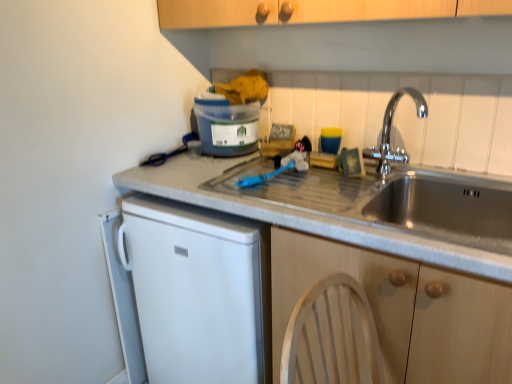
The image size is (512, 384). Find the location of `vacant area that is in front of matte plastic container at upper center`. vacant area that is in front of matte plastic container at upper center is located at coordinates (211, 168).